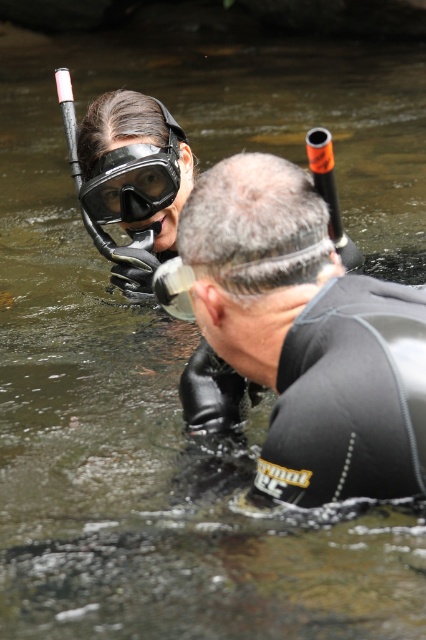
Which of these two, black rubber wetsuit at center or matte black goggles at upper left, stands shorter?

matte black goggles at upper left is shorter.

Which is in front, point (244, 289) or point (83, 182)?

Point (244, 289)

Where is `black rubber wetsuit at center`? The height and width of the screenshot is (640, 426). black rubber wetsuit at center is located at coordinates (307, 333).